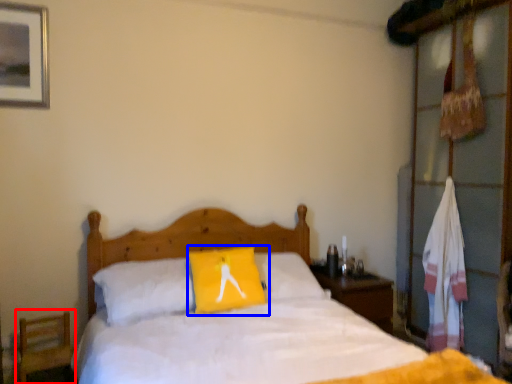
Question: Which point is closer to the camera, armchair (highlighted by a red box) or pillow (highlighted by a blue box)?

Choices:
 (A) armchair
 (B) pillow

Answer: (A)